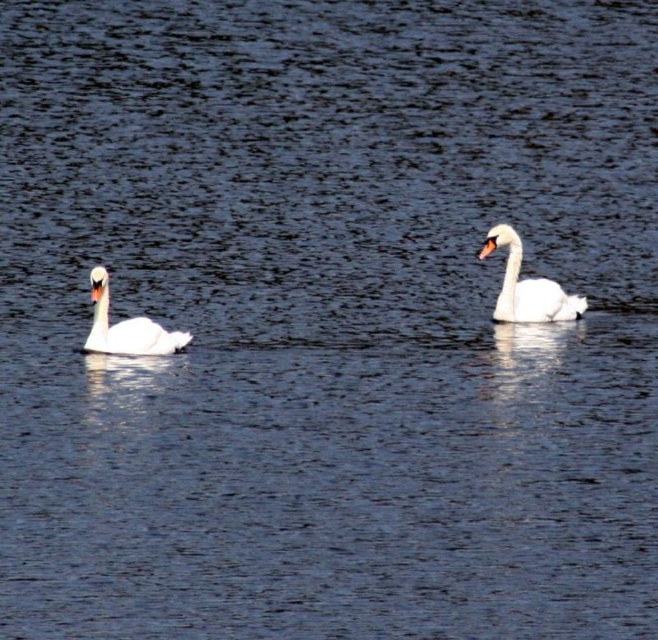
Question: Is the position of white glossy swan at right more distant than that of white matte swan at left?

Choices:
 (A) yes
 (B) no

Answer: (A)

Question: Can you confirm if white glossy swan at right is positioned below white matte swan at left?

Choices:
 (A) yes
 (B) no

Answer: (B)

Question: Among these objects, which one is nearest to the camera?

Choices:
 (A) white matte swan at left
 (B) white glossy swan at right

Answer: (A)

Question: Does white glossy swan at right appear on the right side of white matte swan at left?

Choices:
 (A) yes
 (B) no

Answer: (A)

Question: Among these points, which one is farthest from the camera?

Choices:
 (A) coord(163,348)
 (B) coord(509,314)

Answer: (B)